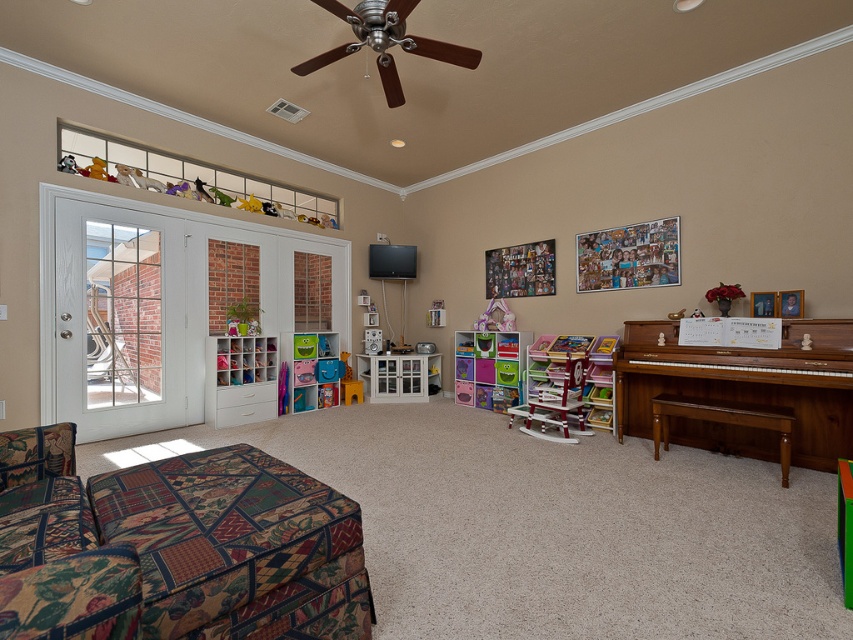
You are a guest in the playroom and want to sit down. You see the patterned fabric couch at lower left and the multicolored plastic toy storage at center. Which object is bigger and would be more comfortable to sit on?

The patterned fabric couch at lower left is larger in size than the multicolored plastic toy storage at center, so it would be more comfortable to sit on.

You are a parent trying to decide where to place a new floor lamp. The lamp is 1.8 meters tall. Considering the patterned fabric couch at lower left and the multicolored plastic toy storage at center, which object is shorter and would allow the lamp to be placed next to it without blocking the view of the taller object?

The patterned fabric couch at lower left is shorter than the multicolored plastic toy storage at center. Since the lamp is 1.8 meters tall, placing it next to the patterned fabric couch at lower left ensures the lamp won not block the view of the taller multicolored plastic toy storage at center.